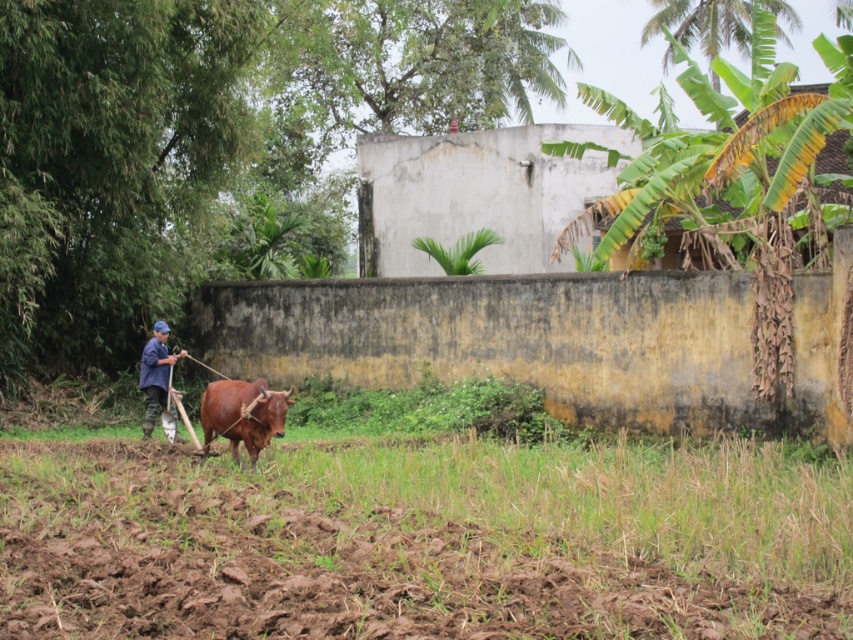
You are standing in the rural scene and want to approach the brown leather bull at center. Given that the concrete wall in the midground is 30 feet away from you, can you safely walk towards the bull without crossing the wall?

The brown leather bull at center is 36.99 feet away from you, while the concrete wall is only 30 feet away. This means the wall is closer to you than the bull. To reach the bull, you would have to go around the wall since you can not walk through it.

You are standing at the point marked by the coordinates point (405,545). Based on the scene described, what do you see directly in front of you?

The point (405,545) corresponds to green grass at lower center, so you would see green grass directly in front of you.